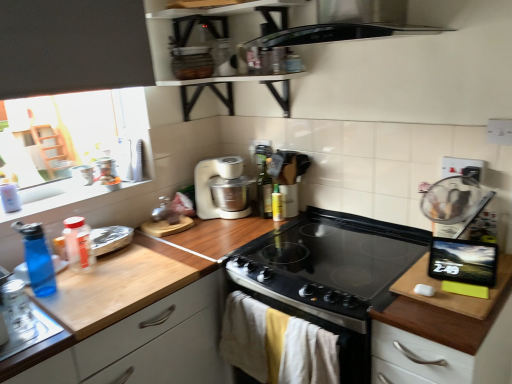
Locate an element on the screen. space that is in front of translucent plastic bottle at left, the third bottle when ordered from right to left is located at coordinates point(75,292).